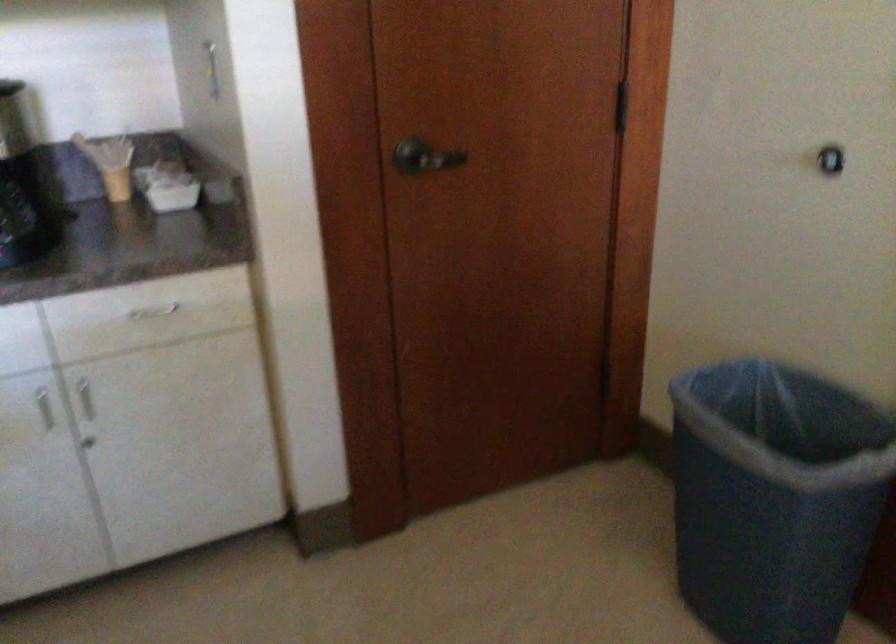
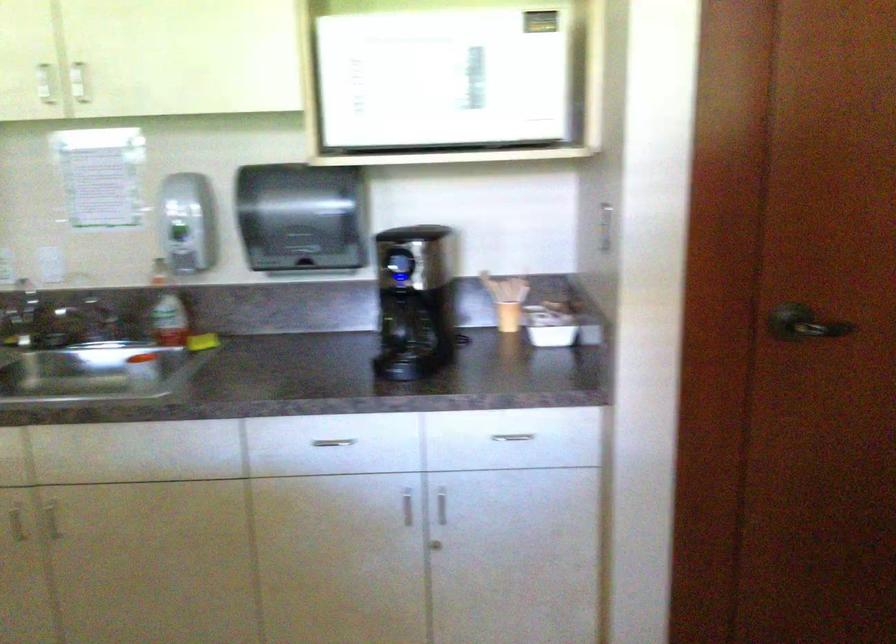
In the second image, find the point that corresponds to the point at 154,313 in the first image.

(512, 437)